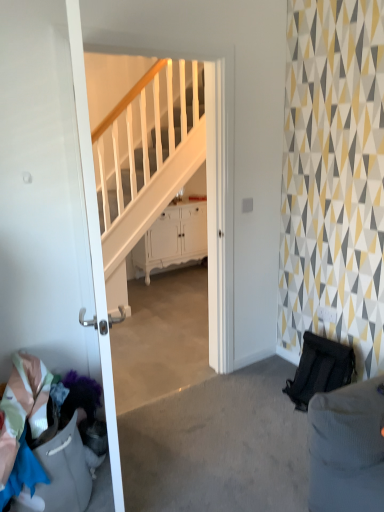
You are a GUI agent. You are given a task and a screenshot of the screen. Output one action in this format:
    pyautogui.click(x=<x>, y=<y>)
    Task: Click on the unoccupied space behind white glossy door at left
    This screenshot has height=512, width=384.
    Given the screenshot: What is the action you would take?
    pyautogui.click(x=162, y=426)